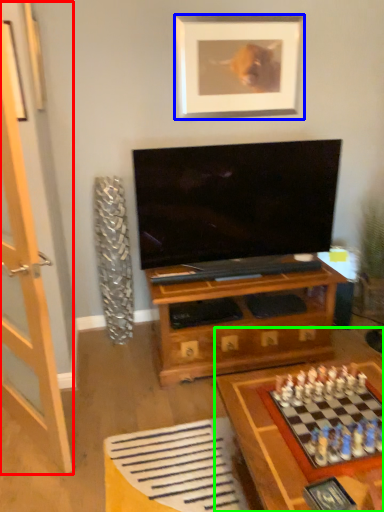
Question: Which object is positioned farthest from glass door (highlighted by a red box)? Select from picture frame (highlighted by a blue box) and table (highlighted by a green box).

Choices:
 (A) picture frame
 (B) table

Answer: (A)